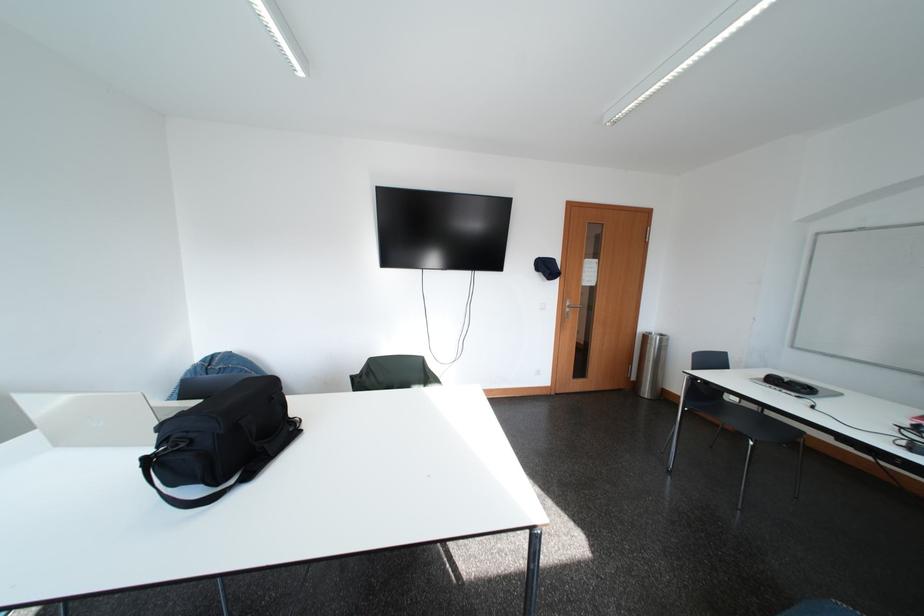
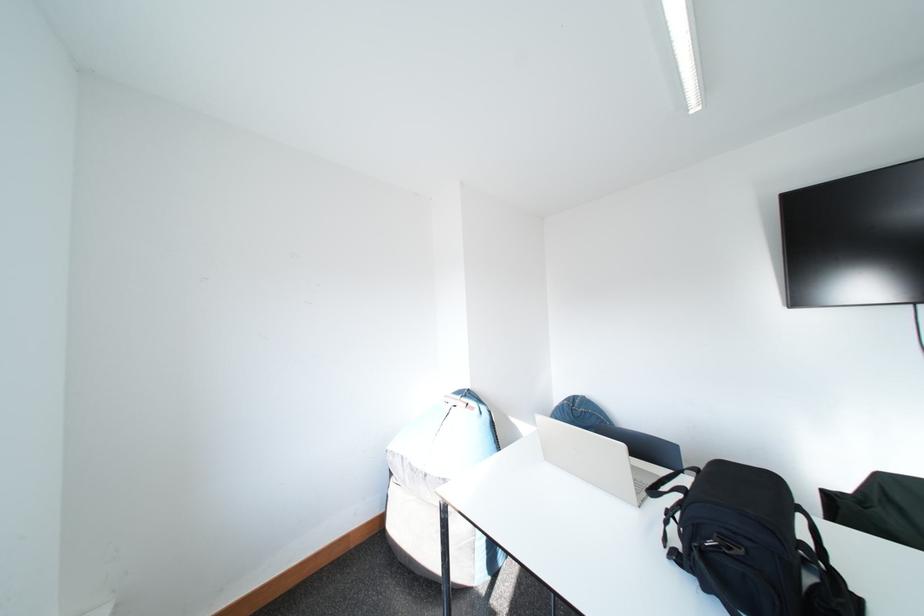
Find the pixel in the second image that matches (67,448) in the first image.

(557, 463)